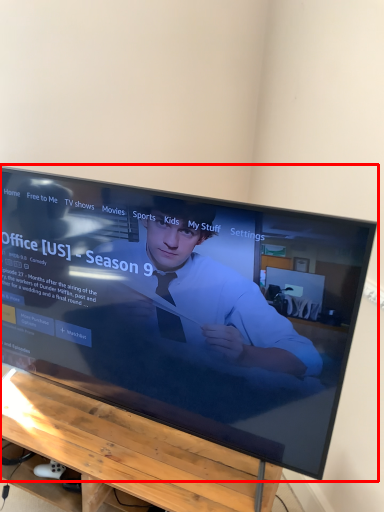
Question: From the image's perspective, what is the correct spatial relationship of television (annotated by the red box) in relation to furniture?

Choices:
 (A) above
 (B) below

Answer: (A)